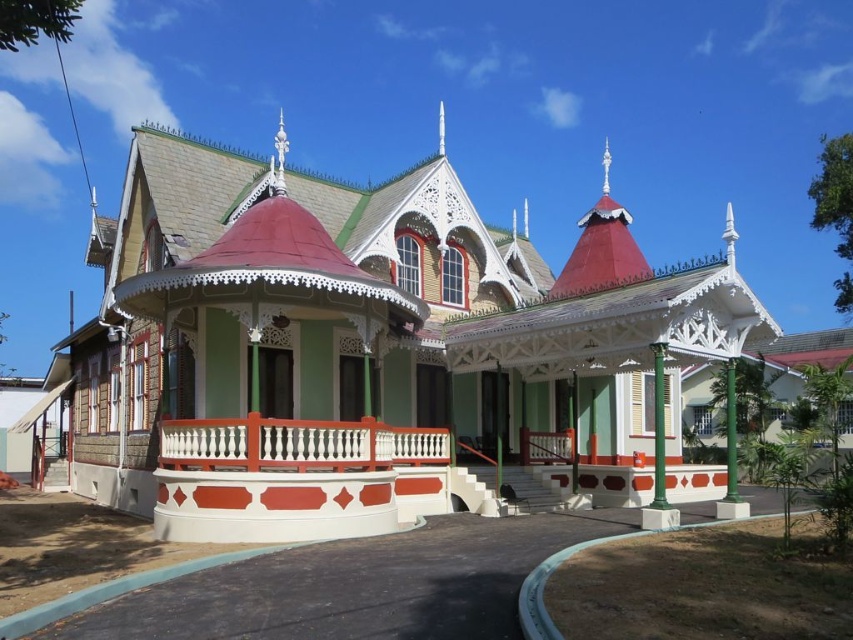
Does point (219, 465) lie behind point (654, 364)?

No, (219, 465) is closer to viewer.

Who is more forward, (177, 458) or (653, 397)?

Point (177, 458) is in front.

Where is `white painted wood railing at center`? The image size is (853, 640). white painted wood railing at center is located at coordinates (297, 444).

Based on the photo, can you confirm if green wood gazebo at center is thinner than white painted wood railing at center?

No.

Who is higher up, green wood gazebo at center or white painted wood railing at center?

green wood gazebo at center is higher up.

From the picture: Who is more forward, [619,243] or [339,438]?

Positioned in front is point [339,438].

Locate an element on the screen. Image resolution: width=853 pixels, height=640 pixels. green wood gazebo at center is located at coordinates (376, 342).

Between point (297, 532) and point (659, 465), which one is positioned behind?

Positioned behind is point (659, 465).

Is the position of green wood gazebo at center more distant than that of green painted metal pole at lower right?

No, it is not.

This screenshot has height=640, width=853. What do you see at coordinates (376, 342) in the screenshot?
I see `green wood gazebo at center` at bounding box center [376, 342].

In order to click on green wood gazebo at center in this screenshot , I will do `click(376, 342)`.